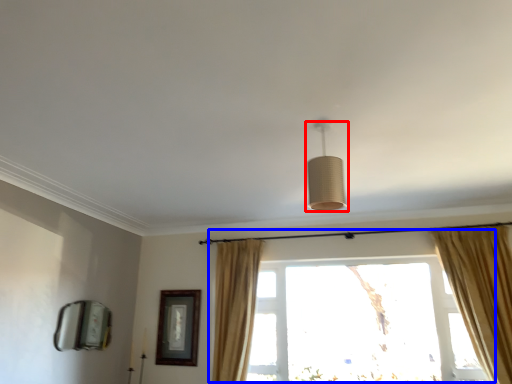
Question: Which object is closer to the camera taking this photo, lamp (highlighted by a red box) or window (highlighted by a blue box)?

Choices:
 (A) lamp
 (B) window

Answer: (A)